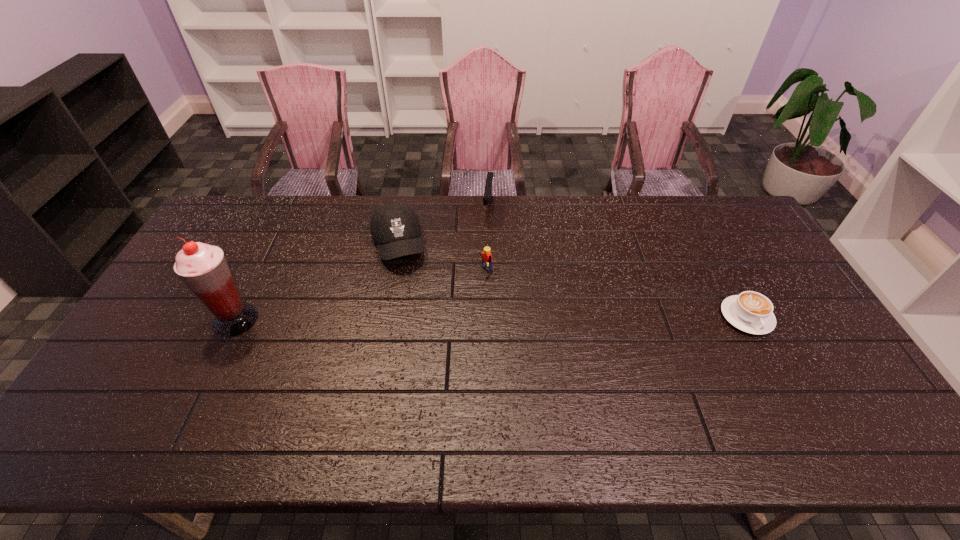
I want to click on the leftmost object, so click(x=204, y=268).

This screenshot has height=540, width=960. In order to click on smoothie in this screenshot , I will do `click(204, 268)`.

This screenshot has height=540, width=960. Find the location of `the rightmost object`. the rightmost object is located at coordinates (751, 312).

You are a GUI agent. You are given a task and a screenshot of the screen. Output one action in this format:
    pyautogui.click(x=<x>, y=<y>)
    Task: Click on the cappuccino
    
    Given the screenshot: What is the action you would take?
    pyautogui.click(x=751, y=312)

The image size is (960, 540). I want to click on Lego, so click(486, 256).

The height and width of the screenshot is (540, 960). In order to click on the fourth object from right to left in this screenshot , I will do `click(395, 227)`.

Find the location of a particular element. This screenshot has height=540, width=960. pistol is located at coordinates (488, 191).

The height and width of the screenshot is (540, 960). Find the location of `free location located on the right of the smoothie`. free location located on the right of the smoothie is located at coordinates (391, 320).

This screenshot has height=540, width=960. Find the location of `vacant space located on the side of the rightmost object with the handle`. vacant space located on the side of the rightmost object with the handle is located at coordinates pos(767,356).

Find the location of `vacant space located on the front-facing side of the Lego`. vacant space located on the front-facing side of the Lego is located at coordinates (444, 306).